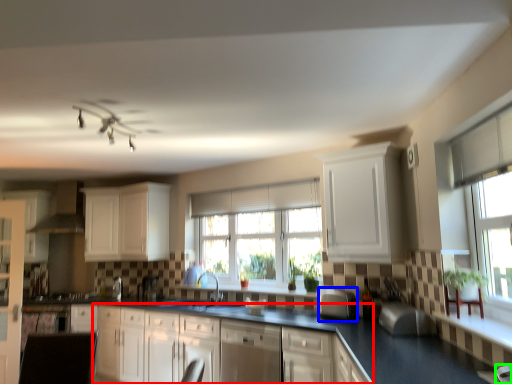
Question: Which object is the farthest from cabinetry (highlighted by a red box)? Choose among these: appliance (highlighted by a blue box) or armchair (highlighted by a green box).

Choices:
 (A) appliance
 (B) armchair

Answer: (B)